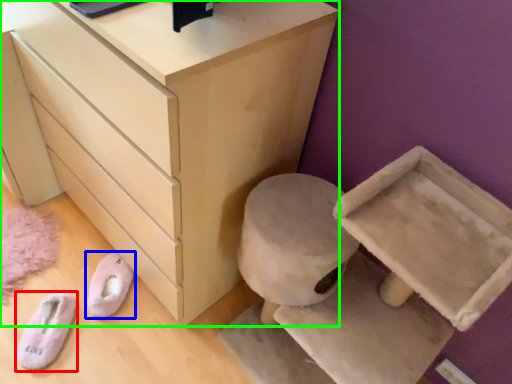
Question: Which object is positioned closest to footwear (highlighted by a red box)? Select from footwear (highlighted by a blue box) and chest of drawers (highlighted by a green box).

Choices:
 (A) footwear
 (B) chest of drawers

Answer: (A)